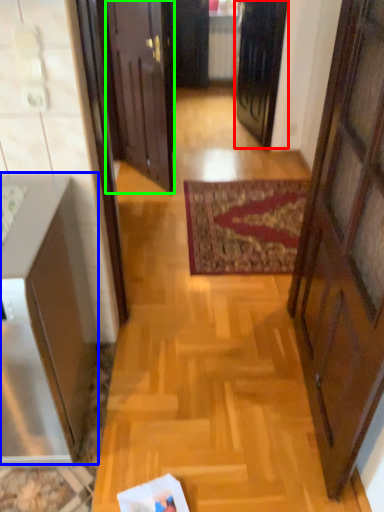
Question: Which object is the closest to the door (highlighted by a red box)? Choose among these: cabinetry (highlighted by a blue box) or door (highlighted by a green box).

Choices:
 (A) cabinetry
 (B) door

Answer: (B)